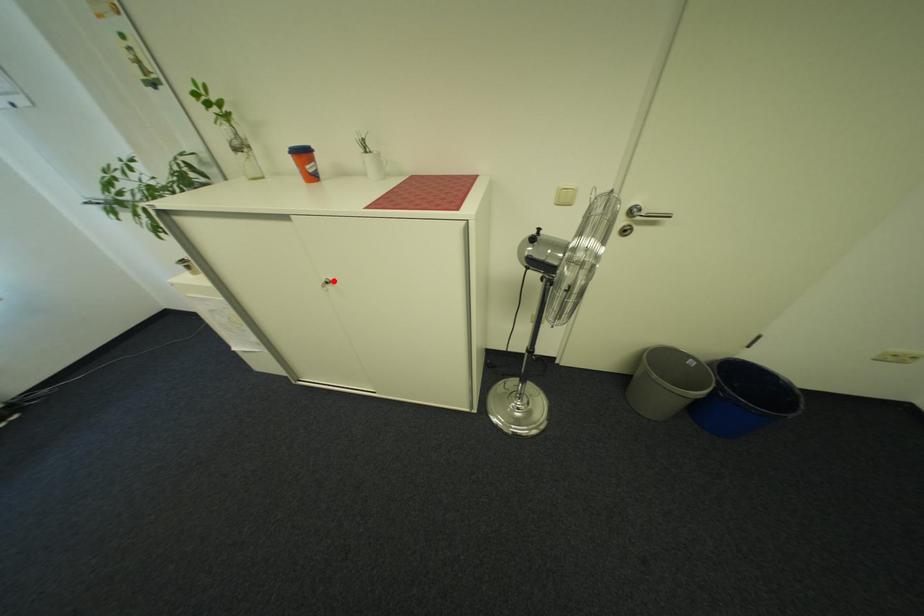
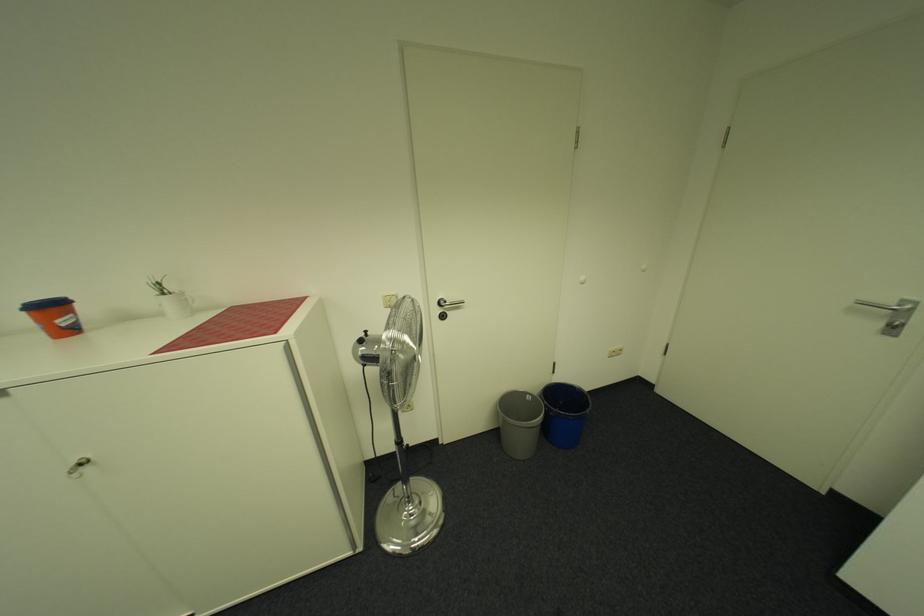
Question: I am providing you with two images of the same scene from different viewpoints. In image1, a red point is highlighted. Considering the same 3D point in image2, which of the following is correct?

Choices:
 (A) It is closer
 (B) It is farther

Answer: (A)